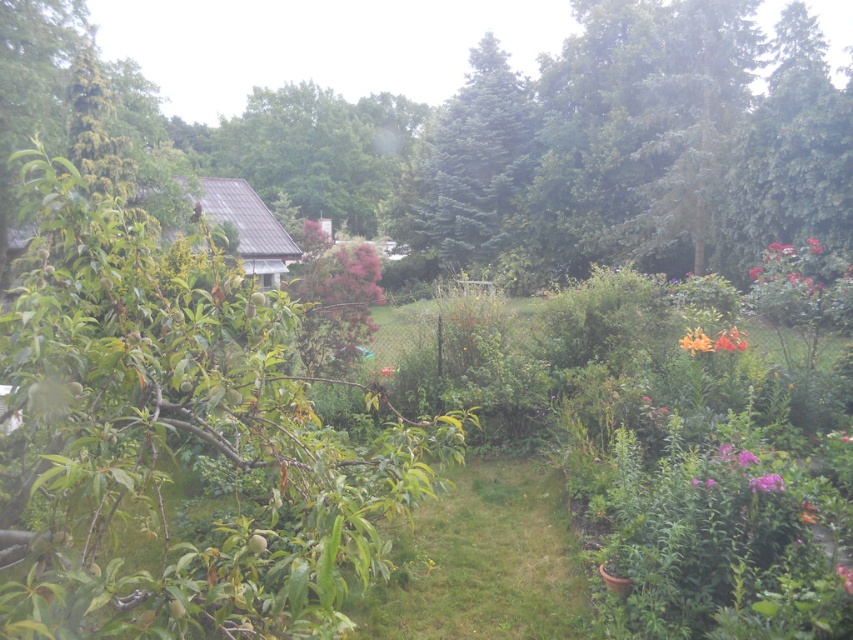
Can you confirm if green grass at center is positioned above pink matte flower at upper right?

No, green grass at center is not above pink matte flower at upper right.

Locate an element on the screen. This screenshot has height=640, width=853. green grass at center is located at coordinates (483, 563).

How much distance is there between green grass at center and purple matte flower at lower right?

6.71 feet

This screenshot has width=853, height=640. Describe the element at coordinates (483, 563) in the screenshot. I see `green grass at center` at that location.

Who is more forward, (483, 516) or (749, 452)?

Point (749, 452)

Identify the location of green grass at center. (483, 563).

Which of these two, green needle-like at center or purple matte flower at center-right, stands shorter?

With less height is purple matte flower at center-right.

Measure the distance between green needle-like at center and purple matte flower at center-right.

A distance of 36.22 meters exists between green needle-like at center and purple matte flower at center-right.

Which is behind, point (486, 180) or point (762, 480)?

Point (486, 180)

In order to click on green needle-like at center in this screenshot , I will do `click(471, 164)`.